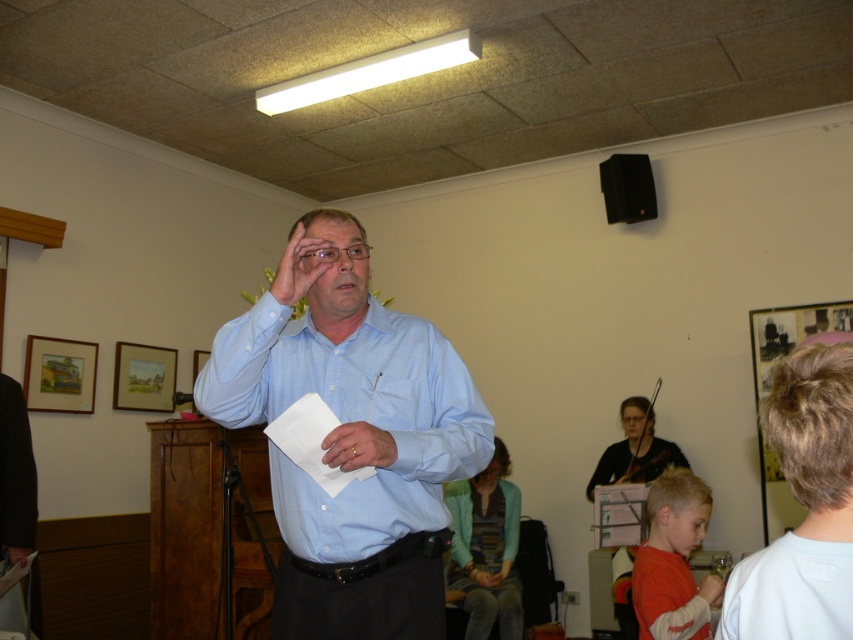
You are standing at the center of the community hall and notice a point marked at coordinates (x=351, y=420). According to the scene, where exactly is this point located?

The point at coordinates (x=351, y=420) is located on the light blue shirt at center.

You are standing in the community hall and need to locate the person wearing the white matte dress shirt at right. According to the scene description, where should you look?

The white matte dress shirt at right is located at point (805, 508), so you should look towards the lower right area of the scene.